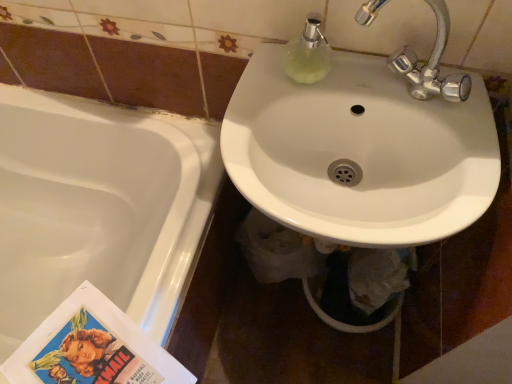
Locate an element on the screen. free space to the right of translucent glass soap dispenser at upper center is located at coordinates coord(390,90).